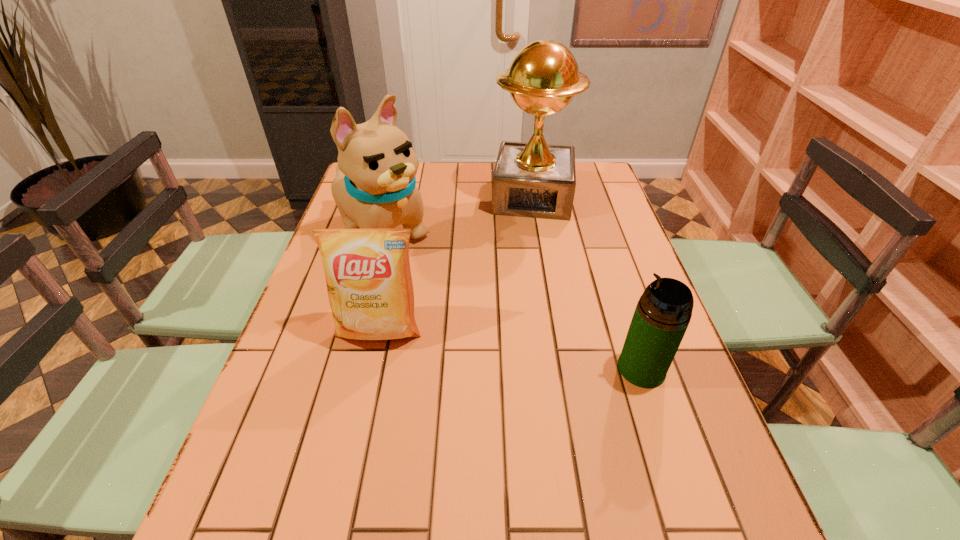
The height and width of the screenshot is (540, 960). What are the coordinates of `crisp (potato chip)` in the screenshot? It's located at [368, 277].

You are a GUI agent. You are given a task and a screenshot of the screen. Output one action in this format:
    pyautogui.click(x=<x>, y=<y>)
    Task: Click on the thermos bottle
    Image resolution: width=960 pixels, height=540 pixels.
    Given the screenshot: What is the action you would take?
    pyautogui.click(x=664, y=310)

Identify the location of puppy. (375, 187).

Where is `award`? This screenshot has width=960, height=540. award is located at coordinates (533, 179).

Locate an element on the screen. This screenshot has height=540, width=960. vacant position located 0.050m on the front-facing side of the crisp (potato chip) is located at coordinates (371, 369).

The height and width of the screenshot is (540, 960). I want to click on vacant region located 0.130m from the spout of the thermos bottle, so click(x=559, y=369).

Where is `vacant point located from the spout of the thermos bottle`? vacant point located from the spout of the thermos bottle is located at coordinates (504, 369).

What are the coordinates of `free spot located 0.130m from the spout of the thermos bottle` in the screenshot? It's located at (559, 369).

Find the location of `free space located 0.130m on the face of the second tallest object`. free space located 0.130m on the face of the second tallest object is located at coordinates (441, 278).

Locate an element on the screen. The height and width of the screenshot is (540, 960). vacant area located 0.240m on the face of the second tallest object is located at coordinates (468, 299).